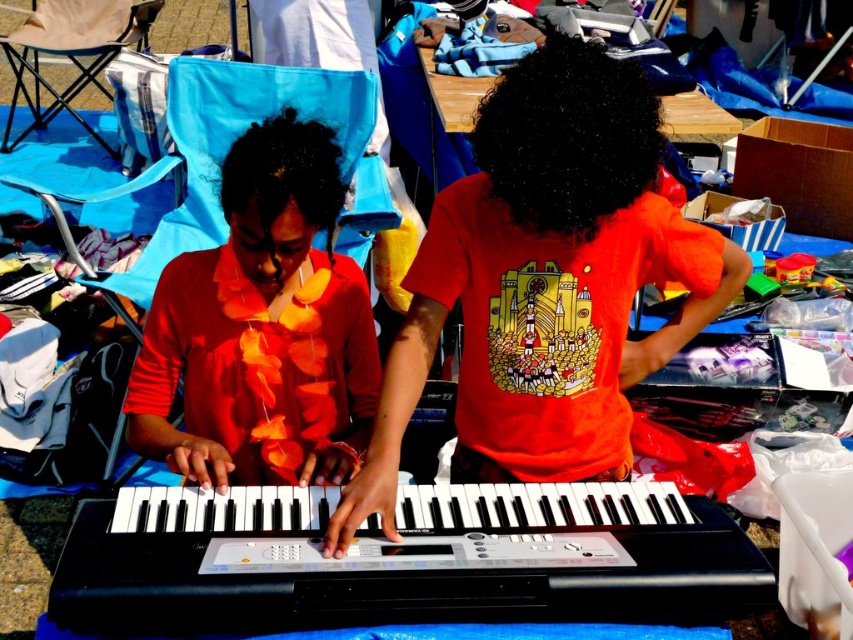
Question: Based on their relative distances, which object is nearer to the matte orange t-shirt at center?

Choices:
 (A) black plastic keyboard at center
 (B) matte orange dress at center

Answer: (A)

Question: Can you confirm if black plastic keyboard at center is positioned below black curly hair at center?

Choices:
 (A) yes
 (B) no

Answer: (A)

Question: Which point appears farthest from the camera in this image?

Choices:
 (A) (592, 192)
 (B) (181, 289)
 (C) (509, 90)

Answer: (B)

Question: Which object is positioned closest to the matte orange dress at center?

Choices:
 (A) black plastic keyboard at center
 (B) black curly hair at center
 (C) matte orange t-shirt at center

Answer: (C)

Question: Is matte orange dress at center to the left of black curly hair at center from the viewer's perspective?

Choices:
 (A) yes
 (B) no

Answer: (A)

Question: Is matte orange t-shirt at center to the left of black plastic keyboard at center from the viewer's perspective?

Choices:
 (A) yes
 (B) no

Answer: (B)